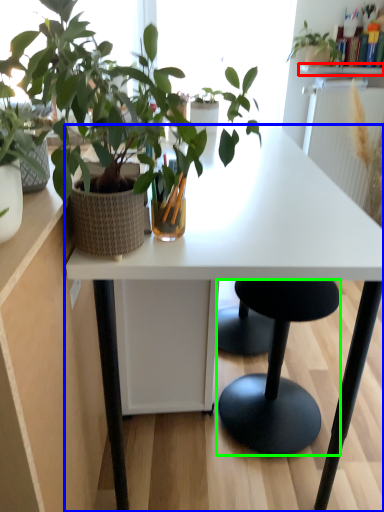
Question: Which object is the closest to the window sill (highlighted by a red box)? Choose among these: desk (highlighted by a blue box) or stool (highlighted by a green box).

Choices:
 (A) desk
 (B) stool

Answer: (A)